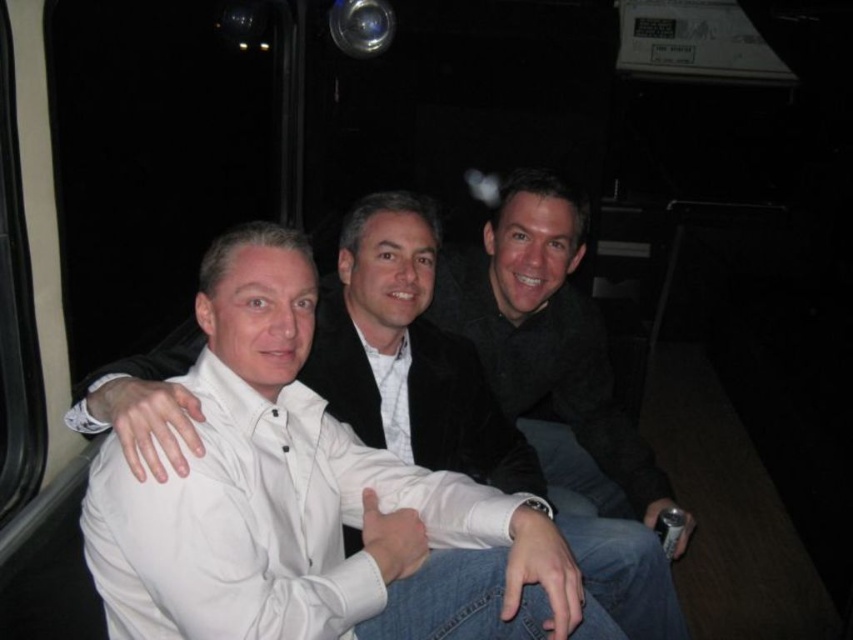
Does white matte shirt at center appear on the right side of black matte jacket at center?

Incorrect, white matte shirt at center is not on the right side of black matte jacket at center.

How distant is white matte shirt at center from black matte jacket at center?

white matte shirt at center and black matte jacket at center are 27.94 inches apart from each other.

Is point (231, 307) more distant than point (543, 228)?

No, (231, 307) is closer to viewer.

At what (x,y) coordinates should I click in order to perform the action: click on white matte shirt at center. Please return your answer as a coordinate pair (x, y). Looking at the image, I should click on (364, 477).